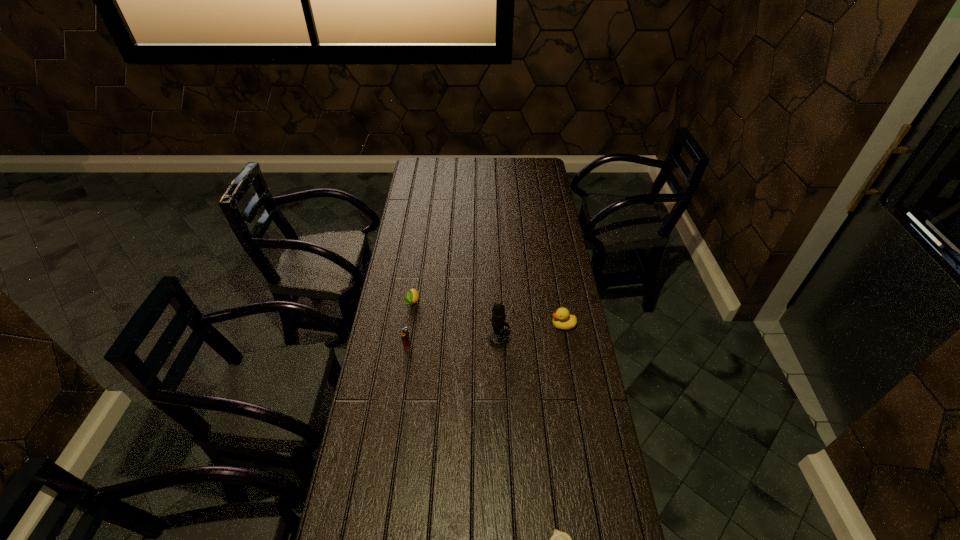
You are a GUI agent. You are given a task and a screenshot of the screen. Output one action in this format:
    pyautogui.click(x=<x>, y=<y>)
    Task: Click on the tallest object
    This screenshot has height=540, width=960.
    Given the screenshot: What is the action you would take?
    click(498, 338)

I want to click on the third object from right to left, so click(498, 338).

This screenshot has height=540, width=960. Find the location of `igniter`. igniter is located at coordinates (405, 334).

Locate an element on the screen. The image size is (960, 540). the rightmost object is located at coordinates (562, 320).

Identify the location of the fourth tallest object. (412, 296).

At what (x,y) coordinates should I click in order to perform the action: click on the left lemon. Please return your answer as a coordinate pair (x, y). The height and width of the screenshot is (540, 960). Looking at the image, I should click on (412, 296).

Where is `vacant region located 0.320m on the front of the tallest object`? The height and width of the screenshot is (540, 960). vacant region located 0.320m on the front of the tallest object is located at coordinates (502, 430).

The height and width of the screenshot is (540, 960). I want to click on free space located 0.280m on the front of the igniter, so click(x=396, y=421).

At what (x,y) coordinates should I click in order to perform the action: click on vacant space situated at the beak of the duck. Please return your answer as a coordinate pair (x, y). Looking at the image, I should click on (452, 325).

Identify the location of vacant space located 0.250m at the beak of the duck. (486, 325).